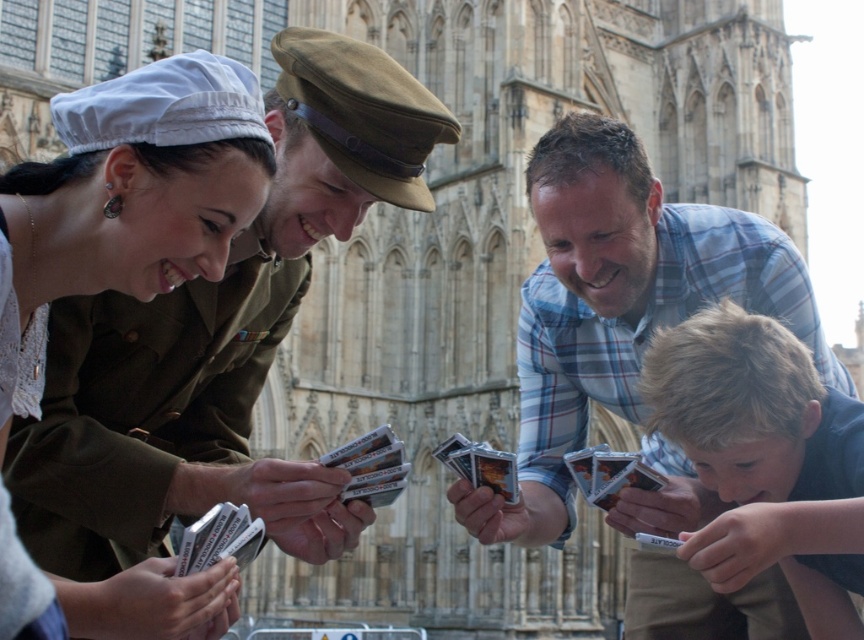
You are a photographer standing at the edge of the scene. You want to take a photo that includes both the blue plaid shirt at center and the blonde hair boy at lower right. Given that your camera has a maximum focus range of 4 meters, will you be able to capture both subjects in focus without moving your position?

The blue plaid shirt at center and the blonde hair boy at lower right are 4.49 meters apart from each other. Since the distance between them exceeds the camera maximum focus range of 4 meters, you will not be able to capture both subjects in focus without moving your position.

What is the 2D coordinate of the matte khaki uniform at center?

The matte khaki uniform at center is located at the 2D coordinate point of (131, 195).

You are a photographer trying to capture a photo of the blue plaid shirt at center and the blonde hair boy at lower right. Which of the two is positioned to the left side of the other?

The blue plaid shirt at center is to the left of the blonde hair boy at lower right.